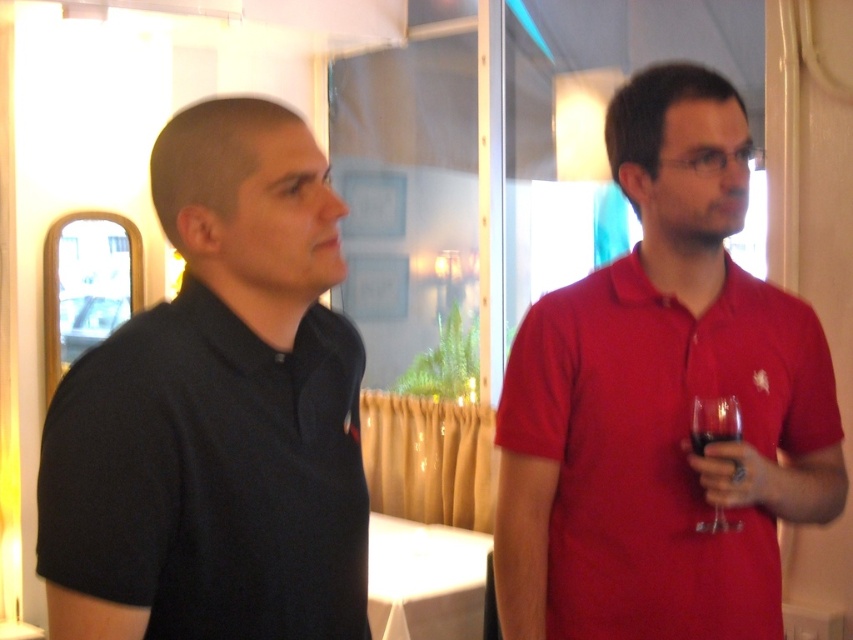
Question: Can you confirm if black matte shirt at left is wider than matte red polo shirt at right?

Choices:
 (A) no
 (B) yes

Answer: (A)

Question: Which object is closer to the camera taking this photo?

Choices:
 (A) black matte shirt at left
 (B) transparent glass at right

Answer: (A)

Question: Which object appears closest to the camera in this image?

Choices:
 (A) transparent glass at right
 (B) matte red polo shirt at right

Answer: (B)

Question: Estimate the real-world distances between objects in this image. Which object is farther from the matte red polo shirt at right?

Choices:
 (A) black matte shirt at left
 (B) transparent glass at right

Answer: (A)

Question: Is matte red polo shirt at right above transparent glass at right?

Choices:
 (A) yes
 (B) no

Answer: (A)

Question: Observing the image, what is the correct spatial positioning of black matte shirt at left in reference to transparent glass at right?

Choices:
 (A) below
 (B) above

Answer: (B)